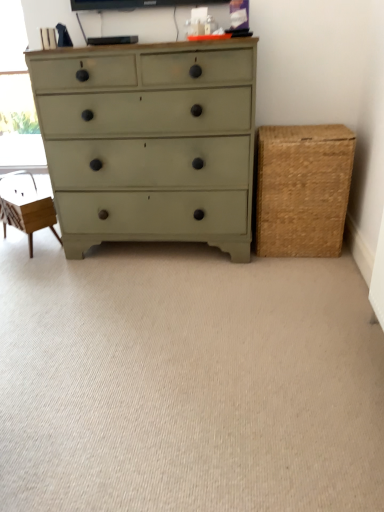
The width and height of the screenshot is (384, 512). Find the location of `vacant space that's between satin green dresser at center and braided wicker basket at right`. vacant space that's between satin green dresser at center and braided wicker basket at right is located at coordinates (291, 258).